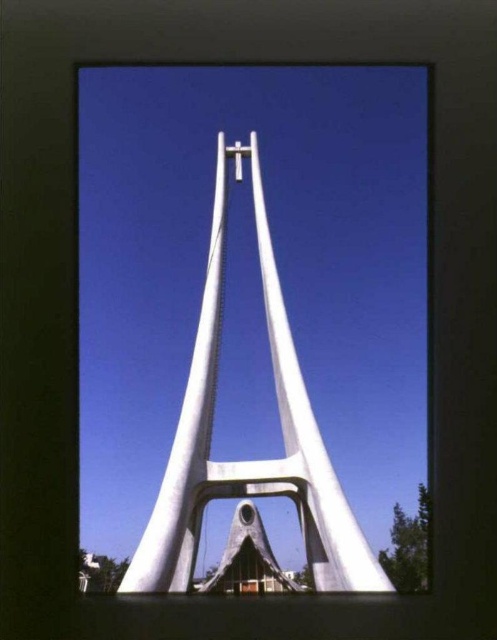
You are an architect planning to place a new sculpture next to the white smooth monument at center and the white matte cross at center. To ensure proper visibility, you need to know which object is bigger. Which one should you consider for spacing adjustments?

The white smooth monument at center is larger in size than the white matte cross at center, so you should consider spacing adjustments around the white smooth monument at center to ensure proper visibility.

In the scene shown: You are standing at the center of the image and want to locate the white smooth monument at center. According to the coordinates provided, in which direction should you look to find it?

The white smooth monument at center is located at coordinates point (248, 460), which is slightly to the right of the center point. Therefore, you should look to the right to find it.

From the picture: You are a photographer planning to capture the white smooth monument at center and the white matte cross at center in a single shot. Based on their positions, which object should you focus on first to ensure both are in frame?

The white smooth monument at center is below the white matte cross at center, so you should focus on the white matte cross at center first to ensure both are in frame.